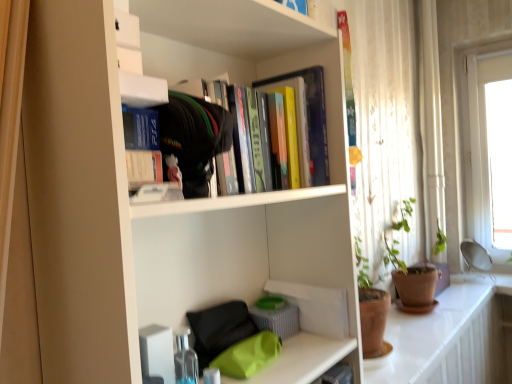
Question: Does white matte bookcase at upper center appear on the right side of hardcover books at upper center, which is the second book from front to back?

Choices:
 (A) yes
 (B) no

Answer: (B)

Question: From the image's perspective, would you say white matte bookcase at upper center is shown under hardcover books at upper center, positioned as the first book in right-to-left order?

Choices:
 (A) yes
 (B) no

Answer: (A)

Question: From the image's perspective, is white matte bookcase at upper center on top of hardcover books at upper center, which is the second book from front to back?

Choices:
 (A) yes
 (B) no

Answer: (B)

Question: Does white matte bookcase at upper center appear on the left side of hardcover books at upper center, arranged as the 2th book when viewed from the left?

Choices:
 (A) no
 (B) yes

Answer: (B)

Question: Is white matte bookcase at upper center positioned before hardcover books at upper center, arranged as the 1th book when viewed from the back?

Choices:
 (A) yes
 (B) no

Answer: (A)

Question: From a real-world perspective, is white matte bookcase at upper center physically below hardcover books at upper center, positioned as the first book in right-to-left order?

Choices:
 (A) no
 (B) yes

Answer: (B)

Question: From a real-world perspective, is matte plastic toy at upper center located higher than hardcover books at upper center, positioned as the first book in right-to-left order?

Choices:
 (A) no
 (B) yes

Answer: (A)

Question: Is matte plastic toy at upper center oriented away from hardcover books at upper center, positioned as the first book in right-to-left order?

Choices:
 (A) yes
 (B) no

Answer: (B)

Question: Is matte plastic toy at upper center positioned beyond the bounds of hardcover books at upper center, arranged as the 2th book when viewed from the left?

Choices:
 (A) no
 (B) yes

Answer: (B)

Question: Is matte plastic toy at upper center positioned in front of hardcover books at upper center, arranged as the 1th book when viewed from the back?

Choices:
 (A) yes
 (B) no

Answer: (A)

Question: From the image's perspective, is matte plastic toy at upper center located above hardcover books at upper center, arranged as the 2th book when viewed from the left?

Choices:
 (A) no
 (B) yes

Answer: (A)

Question: Is matte plastic toy at upper center bigger than hardcover books at upper center, which is the second book from front to back?

Choices:
 (A) yes
 (B) no

Answer: (B)

Question: Is the depth of matte black ps4 case at upper center, which appears as the 2th book when viewed from the right, less than that of white matte paperback book at upper center?

Choices:
 (A) no
 (B) yes

Answer: (A)